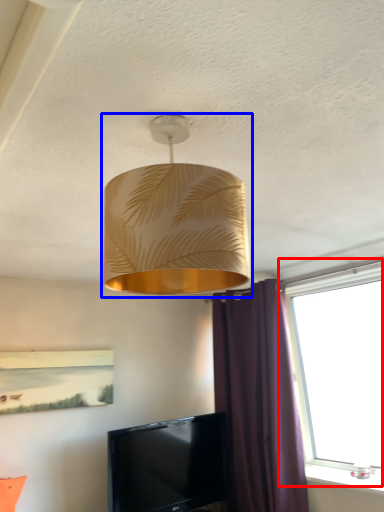
Question: Which object is closer to the camera taking this photo, window (highlighted by a red box) or lamp (highlighted by a blue box)?

Choices:
 (A) window
 (B) lamp

Answer: (B)